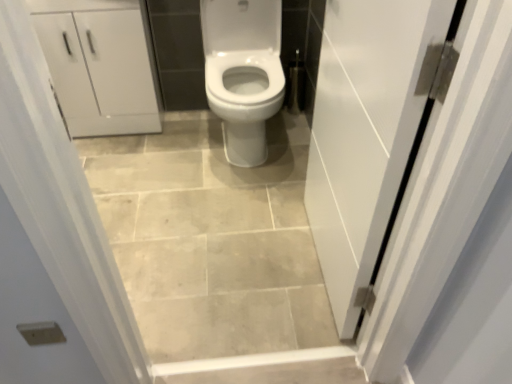
Question: Does beige ceramic tile at center have a lesser width compared to white matte cabinet at upper left?

Choices:
 (A) no
 (B) yes

Answer: (A)

Question: Considering the relative sizes of beige ceramic tile at center and white matte cabinet at upper left in the image provided, is beige ceramic tile at center shorter than white matte cabinet at upper left?

Choices:
 (A) yes
 (B) no

Answer: (A)

Question: Is there a large distance between beige ceramic tile at center and white matte cabinet at upper left?

Choices:
 (A) no
 (B) yes

Answer: (A)

Question: Would you say beige ceramic tile at center contains white matte cabinet at upper left?

Choices:
 (A) yes
 (B) no

Answer: (B)

Question: Is beige ceramic tile at center turned away from white matte cabinet at upper left?

Choices:
 (A) yes
 (B) no

Answer: (B)

Question: Is beige ceramic tile at center wider than white matte cabinet at upper left?

Choices:
 (A) no
 (B) yes

Answer: (B)

Question: Is white matte cabinet at upper left positioned in front of beige ceramic tile at center?

Choices:
 (A) no
 (B) yes

Answer: (A)

Question: Is white matte cabinet at upper left thinner than beige ceramic tile at center?

Choices:
 (A) no
 (B) yes

Answer: (B)

Question: Does white matte cabinet at upper left turn towards beige ceramic tile at center?

Choices:
 (A) no
 (B) yes

Answer: (B)

Question: Considering the relative sizes of white matte cabinet at upper left and beige ceramic tile at center in the image provided, is white matte cabinet at upper left shorter than beige ceramic tile at center?

Choices:
 (A) no
 (B) yes

Answer: (A)

Question: Is white matte cabinet at upper left further to the viewer compared to beige ceramic tile at center?

Choices:
 (A) yes
 (B) no

Answer: (A)

Question: From a real-world perspective, is white matte cabinet at upper left over beige ceramic tile at center?

Choices:
 (A) yes
 (B) no

Answer: (A)

Question: Can you confirm if white glossy door at right is positioned to the right of white matte cabinet at upper left?

Choices:
 (A) no
 (B) yes

Answer: (B)